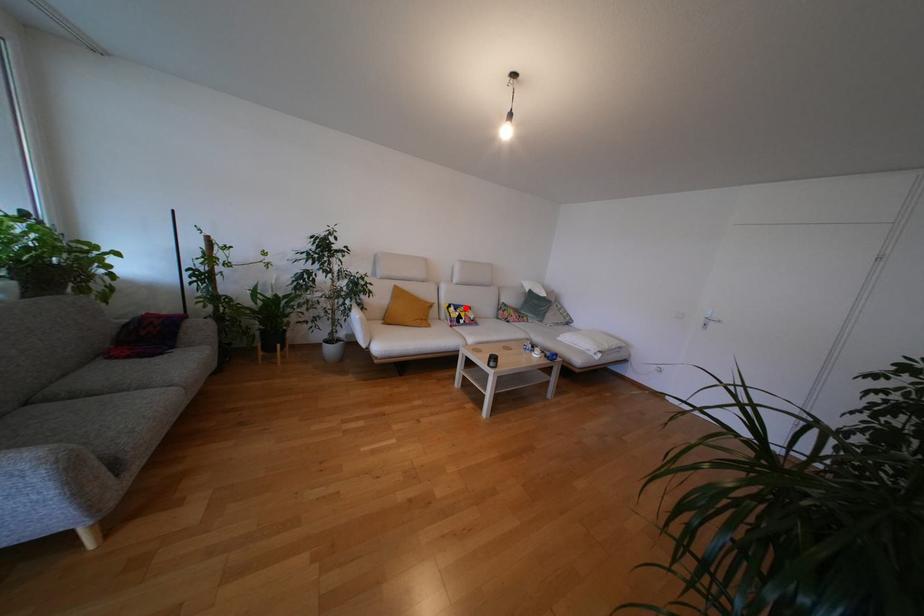
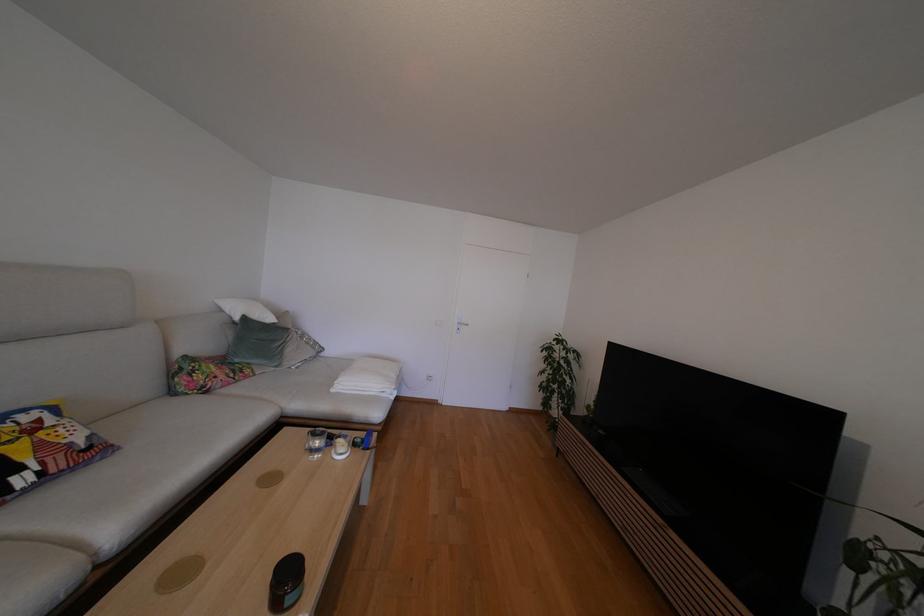
Where in the second image is the point corresponding to the highlighted location from the first image?

(6, 419)